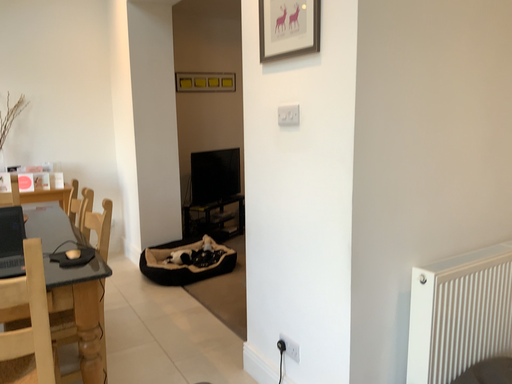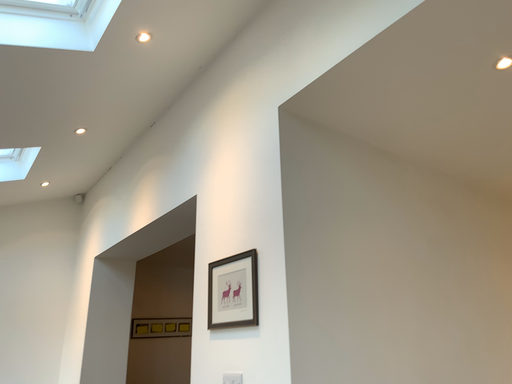
Question: How did the camera likely rotate when shooting the video?

Choices:
 (A) rotated upward
 (B) rotated downward

Answer: (A)